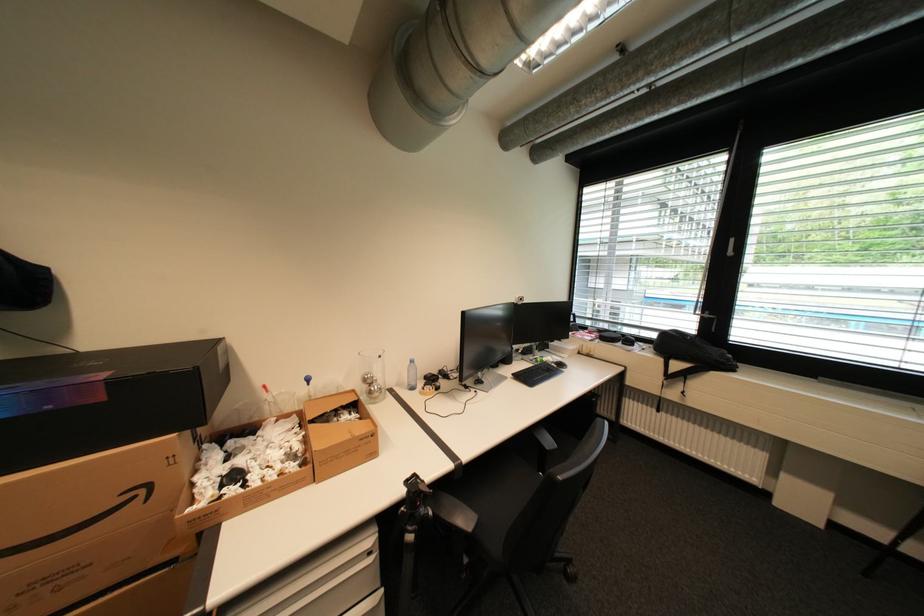
The location [371,375] corresponds to which object?

This point indicates the plastic water bottle.